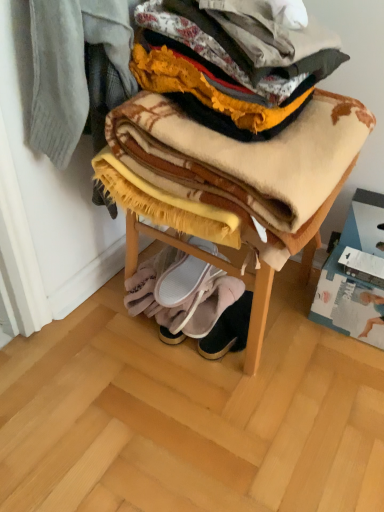
At what (x,y) coordinates should I click in order to perform the action: click on vacant area that lies to the right of leather suede booties at lower center, the third footwear viewed from the top. Please return your answer as a coordinate pair (x, y). This screenshot has width=384, height=512. Looking at the image, I should click on (300, 334).